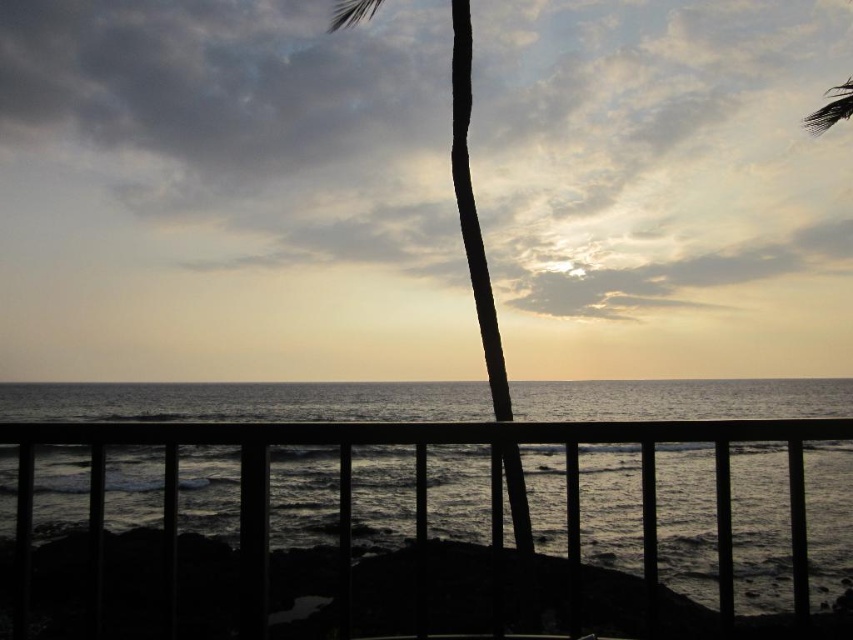
You are standing on a balcony overlooking the ocean and see the black wooden railing at center and the silhouette wood palm tree at center. Which object is closer to you?

The black wooden railing at center is closer to you because it is in front of the silhouette wood palm tree at center.

You are standing on a balcony overlooking the ocean and want to take a photo of the sunrise. The black wooden railing at center is in your way. Can you move to the left or right to avoid it? Please specify the direction.

The black wooden railing at center is located at point [415,497] in 2D space. Since the railing is at the center, moving either left or right would allow you to avoid it.